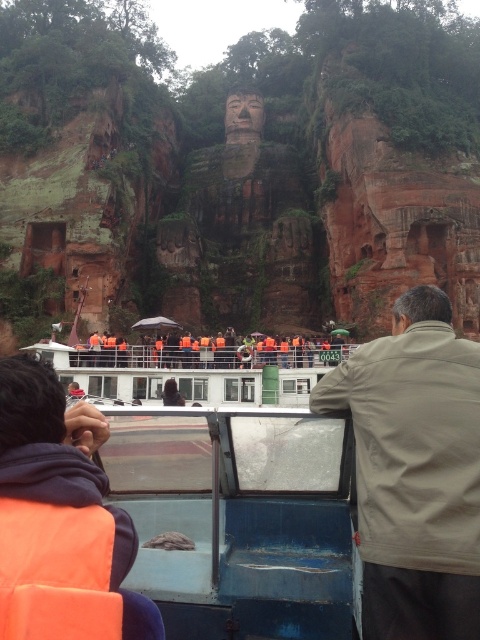
Identify the location of beige fabric jacket at upper right. (415, 470).

From the picture: Between beige fabric jacket at upper right and dark brown leather jacket at center, which one is positioned lower?

dark brown leather jacket at center

Is point (405, 488) less distant than point (171, 390)?

Yes, point (405, 488) is closer to viewer.

Locate an element on the screen. This screenshot has width=480, height=640. beige fabric jacket at upper right is located at coordinates (415, 470).

Can you confirm if beige fabric jacket at upper right is positioned to the left of orange fabric jacket at lower left?

In fact, beige fabric jacket at upper right is to the right of orange fabric jacket at lower left.

Who is taller, beige fabric jacket at upper right or orange fabric jacket at lower left?

beige fabric jacket at upper right is taller.

Describe the element at coordinates (415, 470) in the screenshot. I see `beige fabric jacket at upper right` at that location.

Find the location of a particular element. This screenshot has height=640, width=480. beige fabric jacket at upper right is located at coordinates (415, 470).

Measure the distance from orange fabric jacket at lower left to dark brown leather jacket at center.

A distance of 45.48 meters exists between orange fabric jacket at lower left and dark brown leather jacket at center.

Does orange fabric jacket at lower left have a lesser width compared to dark brown leather jacket at center?

Incorrect, orange fabric jacket at lower left's width is not less than dark brown leather jacket at center's.

Identify the location of orange fabric jacket at lower left. (60, 518).